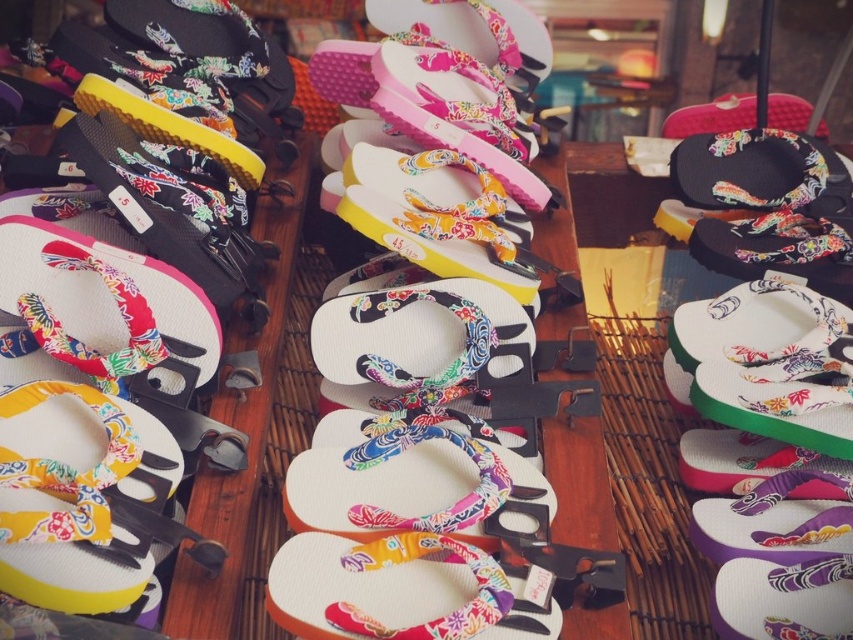
This screenshot has height=640, width=853. Describe the element at coordinates (437, 218) in the screenshot. I see `matte floral flip-flop at center` at that location.

Can you confirm if matte floral flip-flop at center is taller than matte floral flip-flop at left?

No, matte floral flip-flop at center is not taller than matte floral flip-flop at left.

Which is in front, point (483, 372) or point (292, 157)?

Point (483, 372)

Find the location of `matte floral flip-flop at center`. matte floral flip-flop at center is located at coordinates (437, 218).